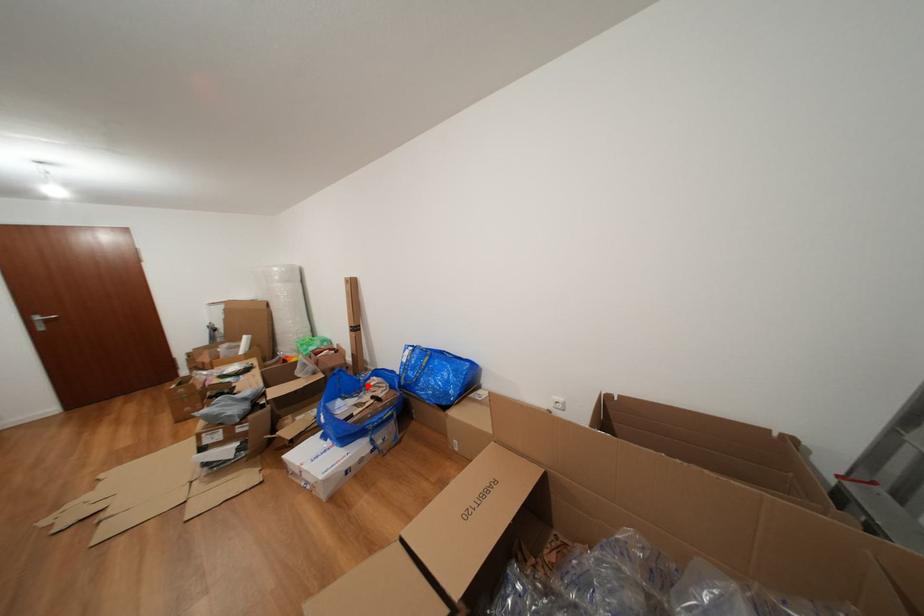
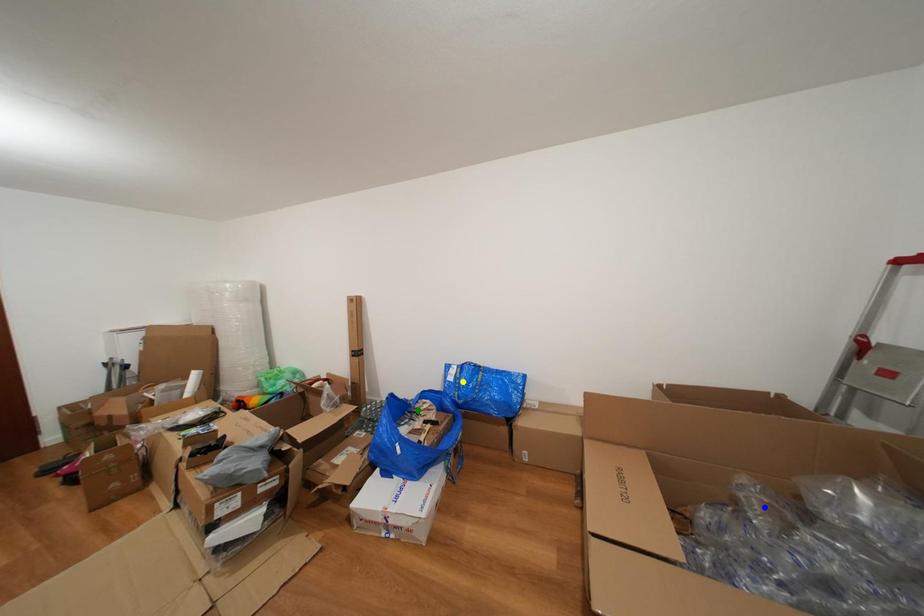
Question: I am providing you with two images of the same scene from different viewpoints. A red point is marked on the first image. You are given multiple points on the second image. Which point in image 2 is actually the same real-world point as the red point in image 1?

Choices:
 (A) yellow point
 (B) green point
 (C) blue point

Answer: (B)